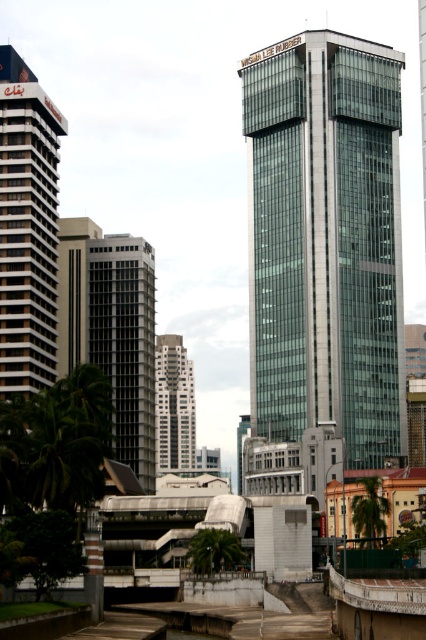
Question: Considering the real-world distances, which object is closest to the dark gray concrete building at center?

Choices:
 (A) green leafy palm tree at lower center
 (B) green glass building at center

Answer: (B)

Question: Which point appears closest to the camera in this image?

Choices:
 (A) [x=388, y=266]
 (B) [x=163, y=408]
 (C) [x=23, y=168]

Answer: (C)

Question: Which point is farther to the camera?

Choices:
 (A) white striped building at left
 (B) green leafy palm tree at lower center
 (C) dark gray concrete building at center
 (D) white textured building at center

Answer: (D)

Question: Is white textured building at center smaller than green leafy palm tree at lower center?

Choices:
 (A) yes
 (B) no

Answer: (B)

Question: Does green glass building at center come behind white striped building at left?

Choices:
 (A) yes
 (B) no

Answer: (A)

Question: Can you confirm if dark gray concrete building at center is positioned to the right of green leafy palm tree at lower center?

Choices:
 (A) yes
 (B) no

Answer: (B)